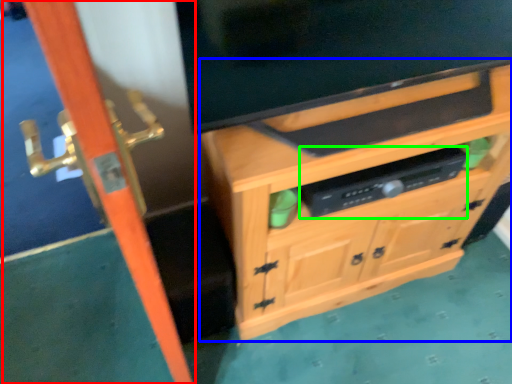
Question: Based on their relative distances, which object is nearer to screen door (highlighted by a red box)? Choose from cabinetry (highlighted by a blue box) and appliance (highlighted by a green box).

Choices:
 (A) cabinetry
 (B) appliance

Answer: (A)